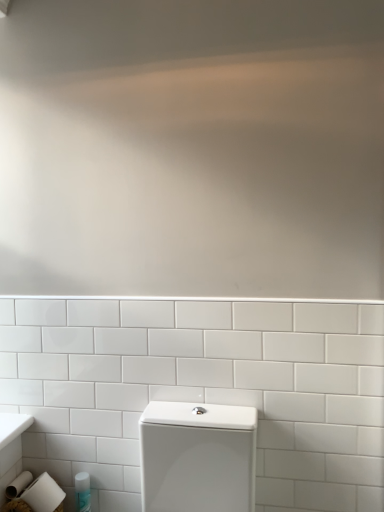
What do you see at coordinates (83, 492) in the screenshot? I see `translucent plastic bottle at lower left` at bounding box center [83, 492].

Locate an element on the screen. translucent plastic bottle at lower left is located at coordinates (83, 492).

This screenshot has height=512, width=384. What do you see at coordinates (197, 457) in the screenshot?
I see `white glossy toilet at lower center` at bounding box center [197, 457].

The image size is (384, 512). What are the coordinates of `white glossy toilet at lower center` in the screenshot? It's located at (197, 457).

Identify the location of translucent plastic bottle at lower left. The image size is (384, 512). (83, 492).

Is white glossy toilet at lower center to the left of translucent plastic bottle at lower left from the viewer's perspective?

No, white glossy toilet at lower center is not to the left of translucent plastic bottle at lower left.

Is white glossy toilet at lower center closer to camera compared to translucent plastic bottle at lower left?

Yes, it is in front of translucent plastic bottle at lower left.

Looking at this image, which point is more forward, (190,461) or (76,477)?

The point (190,461) is in front.

From the image's perspective, between white glossy toilet at lower center and translucent plastic bottle at lower left, who is located below?

translucent plastic bottle at lower left.

From a real-world perspective, is white glossy toilet at lower center above or below translucent plastic bottle at lower left?

white glossy toilet at lower center is above translucent plastic bottle at lower left.

Considering the relative sizes of white glossy toilet at lower center and translucent plastic bottle at lower left in the image provided, is white glossy toilet at lower center thinner than translucent plastic bottle at lower left?

No.

Which of these two, white glossy toilet at lower center or translucent plastic bottle at lower left, stands shorter?

translucent plastic bottle at lower left.

Considering the sizes of white glossy toilet at lower center and translucent plastic bottle at lower left in the image, is white glossy toilet at lower center bigger or smaller than translucent plastic bottle at lower left?

white glossy toilet at lower center is bigger than translucent plastic bottle at lower left.

Would you say white glossy toilet at lower center is inside or outside translucent plastic bottle at lower left?

white glossy toilet at lower center cannot be found inside translucent plastic bottle at lower left.

Is there a large distance between white glossy toilet at lower center and translucent plastic bottle at lower left?

No, white glossy toilet at lower center is not far away from translucent plastic bottle at lower left.

Is white glossy toilet at lower center facing away from translucent plastic bottle at lower left?

No, white glossy toilet at lower center is not facing the opposite direction of translucent plastic bottle at lower left.

Measure the distance between white glossy toilet at lower center and translucent plastic bottle at lower left.

white glossy toilet at lower center is 19.19 inches from translucent plastic bottle at lower left.

Find the location of a particular element. The height and width of the screenshot is (512, 384). toilet above the translucent plastic bottle at lower left (from a real-world perspective) is located at coordinates (197, 457).

Which is more to the left, translucent plastic bottle at lower left or white glossy toilet at lower center?

From the viewer's perspective, translucent plastic bottle at lower left appears more on the left side.

Which is in front, translucent plastic bottle at lower left or white glossy toilet at lower center?

white glossy toilet at lower center is closer to the camera.

Which is behind, point (76, 479) or point (174, 453)?

Positioned behind is point (76, 479).

From the image's perspective, is translucent plastic bottle at lower left located above or below white glossy toilet at lower center?

translucent plastic bottle at lower left is below white glossy toilet at lower center.

From a real-world perspective, which is physically above, translucent plastic bottle at lower left or white glossy toilet at lower center?

In real-world perspective, white glossy toilet at lower center is above.

In terms of width, does translucent plastic bottle at lower left look wider or thinner when compared to white glossy toilet at lower center?

Considering their sizes, translucent plastic bottle at lower left looks slimmer than white glossy toilet at lower center.

Based on the photo, does translucent plastic bottle at lower left have a lesser height compared to white glossy toilet at lower center?

Correct, translucent plastic bottle at lower left is not as tall as white glossy toilet at lower center.

Considering the relative sizes of translucent plastic bottle at lower left and white glossy toilet at lower center in the image provided, is translucent plastic bottle at lower left smaller than white glossy toilet at lower center?

Yes.

Is white glossy toilet at lower center located within translucent plastic bottle at lower left?

No, white glossy toilet at lower center is located outside of translucent plastic bottle at lower left.

Would you say translucent plastic bottle at lower left is a long distance from white glossy toilet at lower center?

translucent plastic bottle at lower left is actually quite close to white glossy toilet at lower center.

Is translucent plastic bottle at lower left facing towards white glossy toilet at lower center?

No, translucent plastic bottle at lower left does not turn towards white glossy toilet at lower center.

Locate an element on the screen. toiletry behind the white glossy toilet at lower center is located at coordinates (83, 492).

This screenshot has width=384, height=512. What are the coordinates of `toilet that appears above the translucent plastic bottle at lower left (from a real-world perspective)` in the screenshot? It's located at (197, 457).

Locate an element on the screen. Image resolution: width=384 pixels, height=512 pixels. toilet that appears above the translucent plastic bottle at lower left (from the image's perspective) is located at coordinates (197, 457).